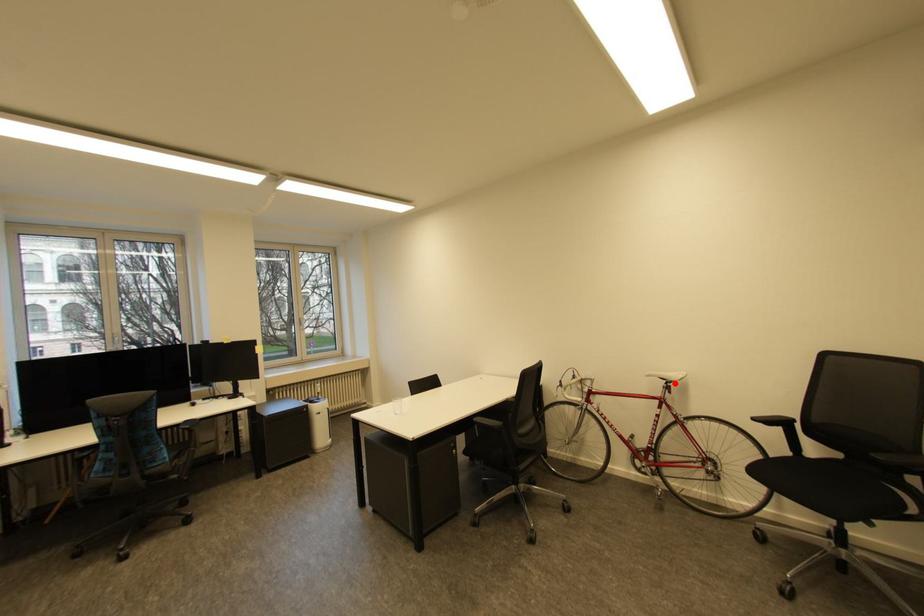
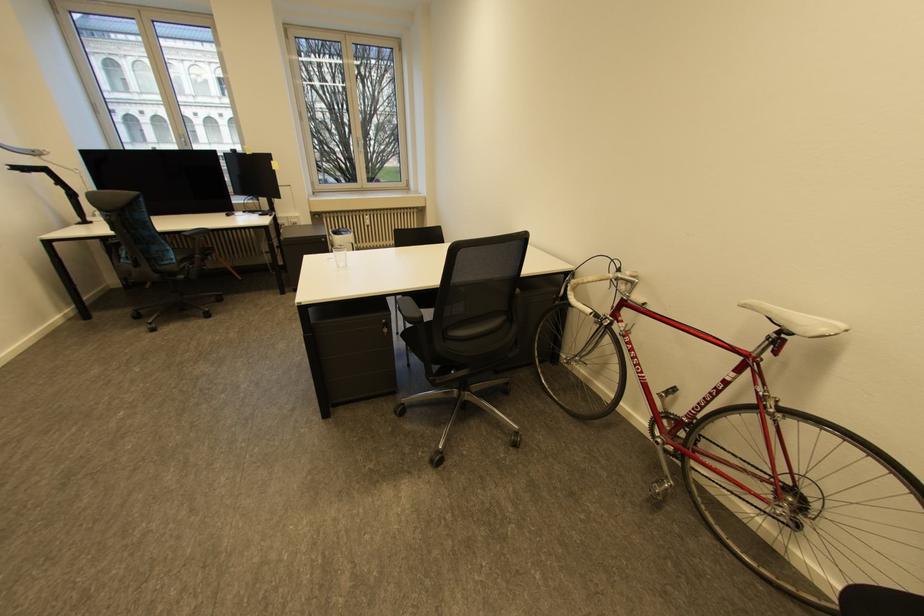
Find the pixel in the second image that matches the highlighted location in the first image.

(789, 331)